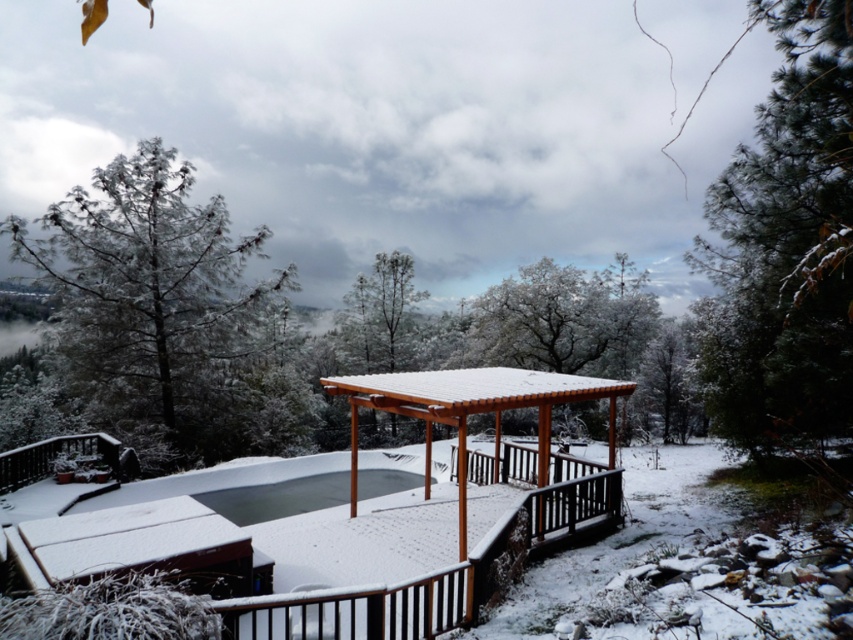
Question: Can you confirm if snow-covered pine tree at left is positioned to the right of snow-covered wooden tree at center?

Choices:
 (A) no
 (B) yes

Answer: (A)

Question: Which of the following is the farthest from the observer?

Choices:
 (A) (738, 392)
 (B) (403, 588)
 (C) (117, 240)

Answer: (C)

Question: Among these objects, which one is nearest to the camera?

Choices:
 (A) snow-covered pine tree at left
 (B) snow-covered wooden tree at center
 (C) wooden pergola at center

Answer: (C)

Question: Is wooden pergola at center positioned behind snow-covered pine tree at left?

Choices:
 (A) no
 (B) yes

Answer: (A)

Question: Based on their relative distances, which object is farther from the wooden pergola at center?

Choices:
 (A) snow-covered wooden tree at center
 (B) snow-covered pine at right
 (C) snow-covered pine tree at left

Answer: (A)

Question: Is wooden pergola at center smaller than snow-covered wooden tree at center?

Choices:
 (A) no
 (B) yes

Answer: (A)